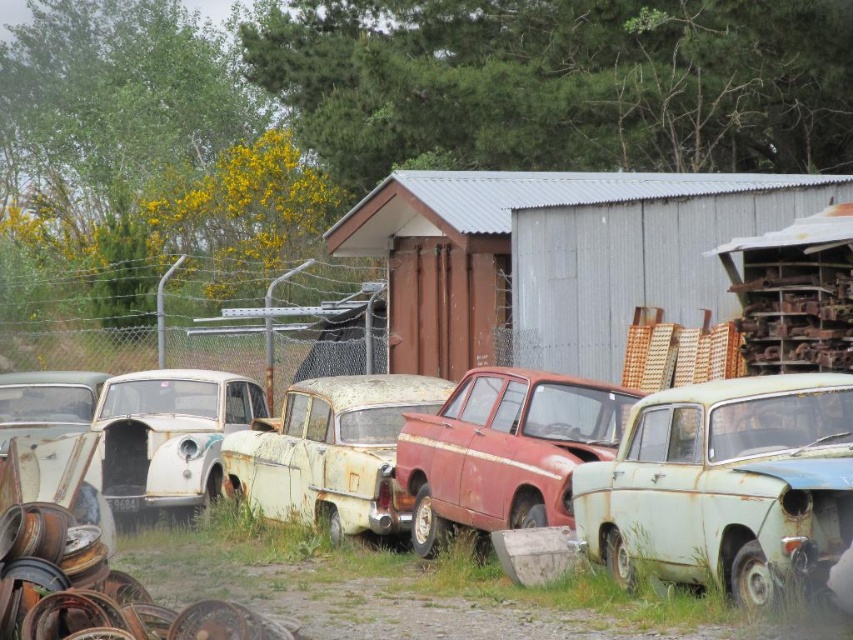
You are standing in the middle of the junkyard and want to locate the green matte car at lower right. Which direction should you move relative to the rusty matte car at center?

The green matte car at lower right is to the right of the rusty matte car at center, so you should move to the right of the rusty matte car at center to find it.

You are a delivery person trying to locate the green matte car at lower right. From the rusty corrugated metal hut at center, which direction should you go to find it?

The rusty corrugated metal hut at center is to the left of the green matte car at lower right, so you should go to the right from the rusty corrugated metal hut at center to find the green matte car at lower right.